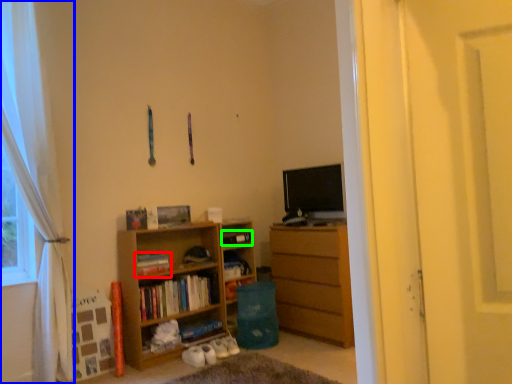
Question: Which object is the farthest from book (highlighted by a red box)? Choose among these: curtain (highlighted by a blue box) or book (highlighted by a green box).

Choices:
 (A) curtain
 (B) book

Answer: (A)